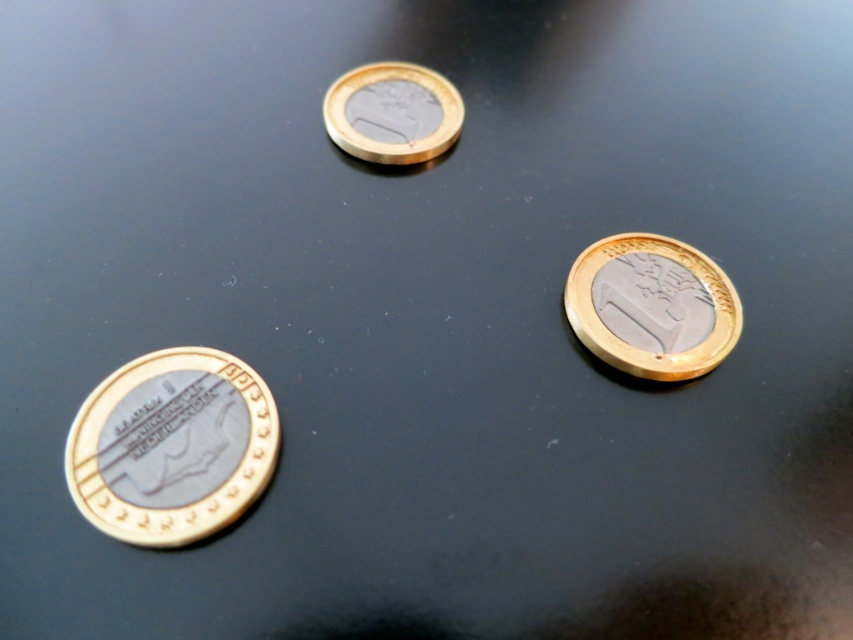
Does gold-plated coin at bottom left come in front of gold-plated euro coin at center-right?

That is True.

The image size is (853, 640). Identify the location of gold-plated coin at bottom left. (172, 445).

Where is `gold-plated coin at bottom left`? The width and height of the screenshot is (853, 640). gold-plated coin at bottom left is located at coordinates click(x=172, y=445).

Who is higher up, gold-plated coin at bottom left or gold-plated coin at center?

Positioned higher is gold-plated coin at center.

The height and width of the screenshot is (640, 853). Describe the element at coordinates (172, 445) in the screenshot. I see `gold-plated coin at bottom left` at that location.

Locate an element on the screen. Image resolution: width=853 pixels, height=640 pixels. gold-plated coin at bottom left is located at coordinates (172, 445).

Find the location of `gold-plated euro coin at center-right`. gold-plated euro coin at center-right is located at coordinates (653, 307).

Which is behind, point (669, 320) or point (344, 106)?

The point (344, 106) is behind.

I want to click on gold-plated euro coin at center-right, so click(x=653, y=307).

You are a GUI agent. You are given a task and a screenshot of the screen. Output one action in this format:
    pyautogui.click(x=<x>, y=<y>)
    Task: Click on the gold-plated euro coin at center-right
    The height and width of the screenshot is (640, 853).
    Given the screenshot: What is the action you would take?
    pyautogui.click(x=653, y=307)